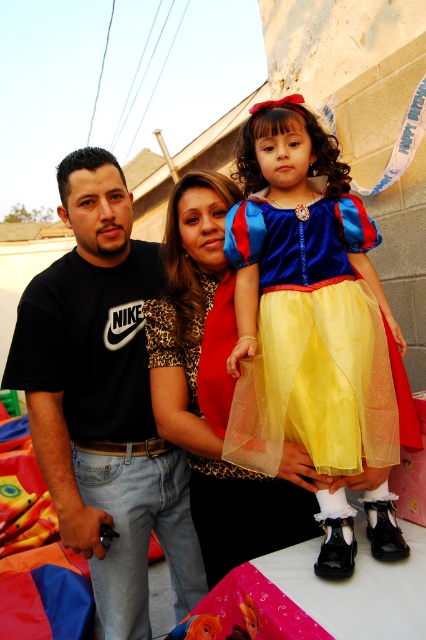
Question: Which of the following is the farthest from the observer?

Choices:
 (A) (170, 484)
 (B) (150, 371)

Answer: (A)

Question: Is velvet yellow dress at center smaller than black nike t-shirt at left?

Choices:
 (A) no
 (B) yes

Answer: (B)

Question: Which point appears farthest from the camera in this image?

Choices:
 (A) (261, 116)
 (B) (178, 554)

Answer: (B)

Question: Does black nike t-shirt at left come in front of velvet leopard print dress at center?

Choices:
 (A) no
 (B) yes

Answer: (A)

Question: Among these points, which one is farthest from the camera?

Choices:
 (A) (218, 547)
 (B) (97, 314)
 (C) (244, 276)

Answer: (B)

Question: Does velvet yellow dress at center have a smaller size compared to black nike t-shirt at left?

Choices:
 (A) yes
 (B) no

Answer: (A)